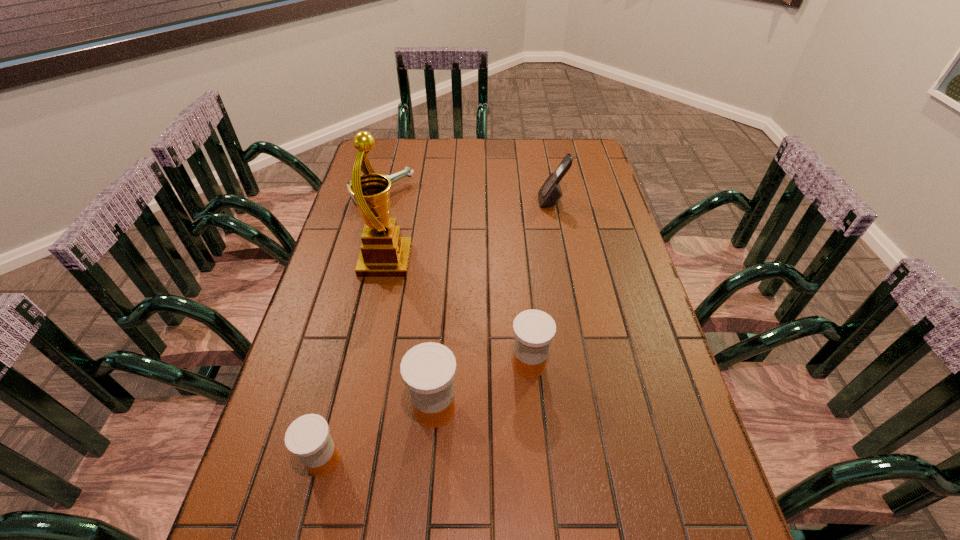
Where is `vacant place for an extra medicine on the right`? The image size is (960, 540). vacant place for an extra medicine on the right is located at coordinates (611, 326).